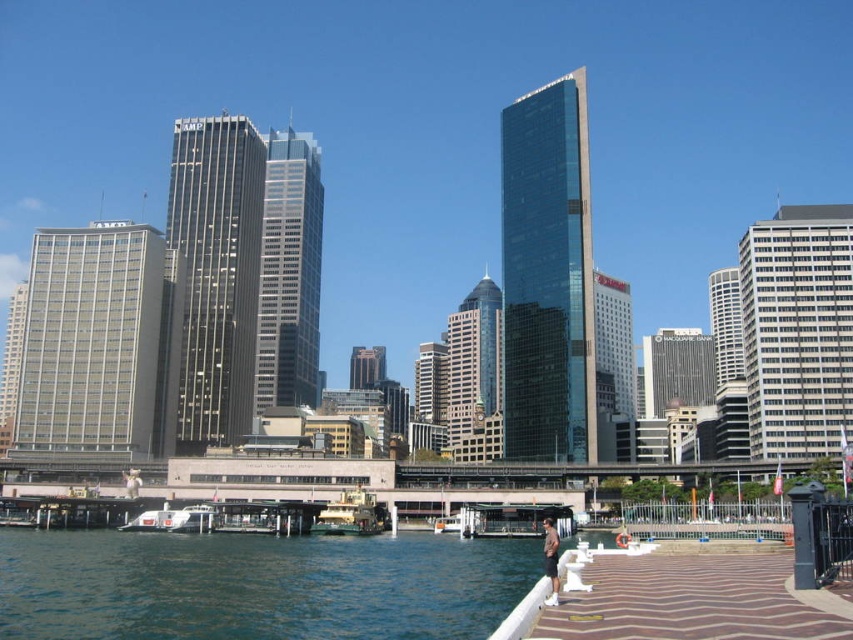
You are standing at the waterfront and see two points marked on the image. The first point is at coordinates point (140,531) and the second is at point (550,518). Which point is closer to you?

Point (140,531) is in front of point (550,518), so the first point is closer to you.

You are standing on the waterfront walkway and want to take a photo of the metallic silver boat at center. Where should you position yourself to capture it in the frame?

The metallic silver boat at center is located at point coordinates of (247, 516), so you should position yourself facing that coordinate to capture it in the frame.

You are a photographer trying to capture the entire scene in one shot. You notice the white glossy boat at lower left and the tan leather jacket at lower right. Which object would require you to adjust your camera angle more to ensure both fit in the frame?

The white glossy boat at lower left would require adjusting the camera angle more because it is wider than the tan leather jacket at lower right.